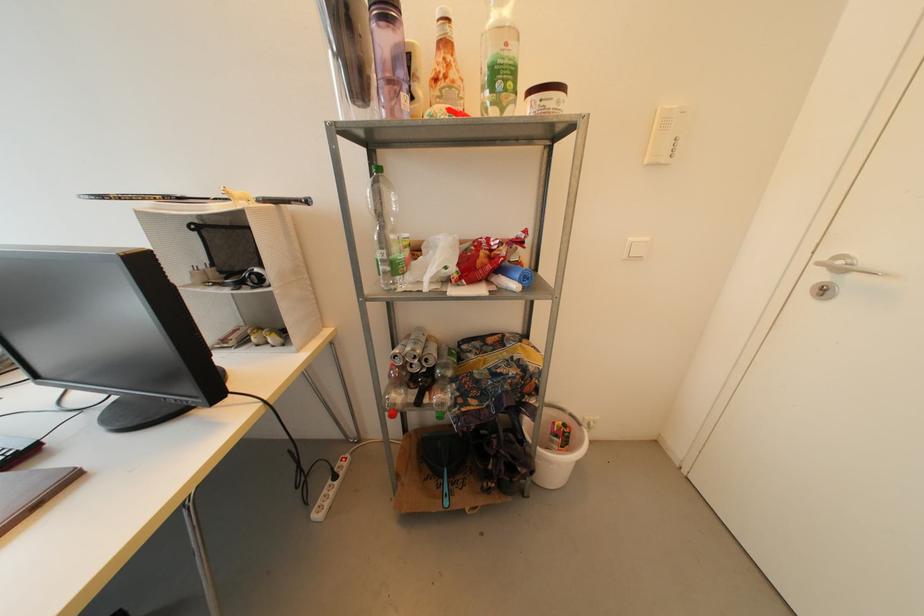
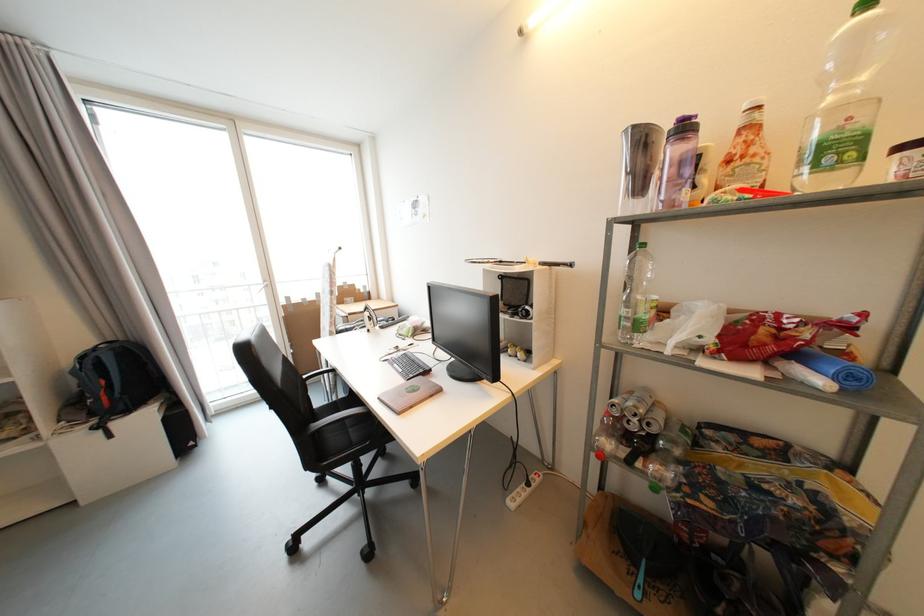
Question: The camera is either moving clockwise (left) or counter-clockwise (right) around the object. The first image is from the beginning of the video and the second image is from the end. Is the camera moving left or right when shooting the video?

Choices:
 (A) Left
 (B) Right

Answer: (B)